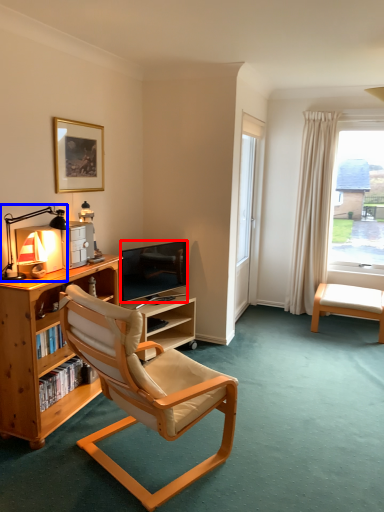
Question: Among these objects, which one is farthest to the camera, television (highlighted by a red box) or lamp (highlighted by a blue box)?

Choices:
 (A) television
 (B) lamp

Answer: (A)